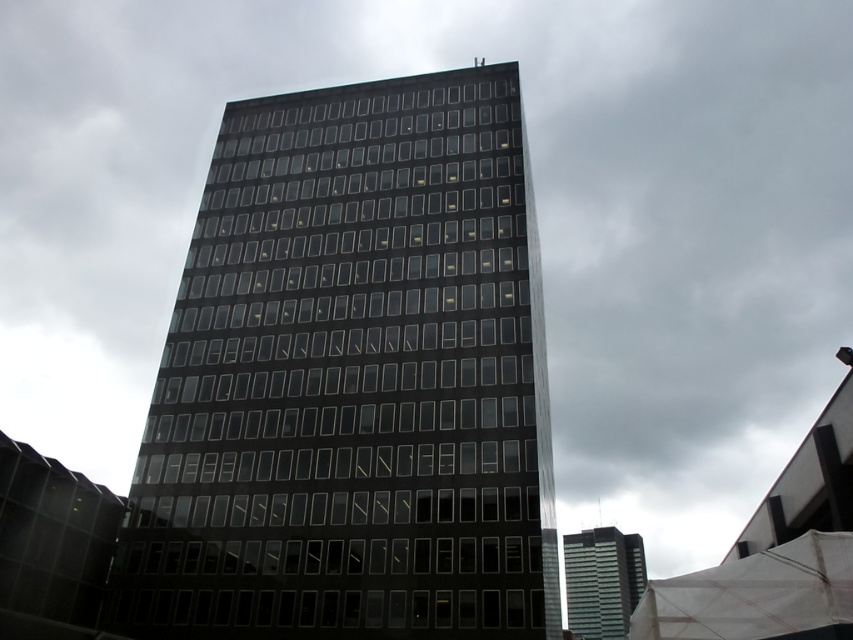
Question: Where is black glass building at center located in relation to glassy reflective skyscraper at center in the image?

Choices:
 (A) below
 (B) above

Answer: (B)

Question: Does black glass building at center have a lesser width compared to glassy reflective skyscraper at center?

Choices:
 (A) no
 (B) yes

Answer: (B)

Question: Is black glass building at center behind glassy reflective skyscraper at center?

Choices:
 (A) yes
 (B) no

Answer: (B)

Question: Which point is closer to the camera taking this photo?

Choices:
 (A) tap(381, 378)
 (B) tap(575, 600)

Answer: (A)